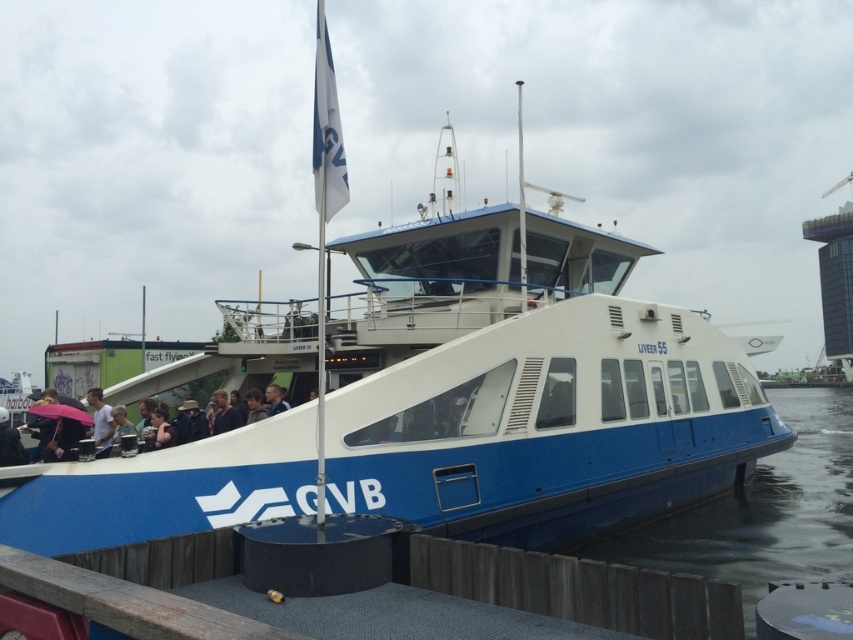
You are standing on the pier and want to take a photo of the blue matte boat at center. If your camera has a maximum focus range of 20 feet, will you be able to capture a clear image of the boat?

The blue matte boat at center is 21.78 feet away from the camera. Since the maximum focus range is 20 feet, the camera cannot focus clearly beyond that distance. Therefore, the boat will appear blurry in the photo.

You are a passenger on the ferry boat and want to know which boat takes up more space between the blue matte boat at center and the blue rubber boat at lower center.

The blue rubber boat at lower center occupies more space than the blue matte boat at center.